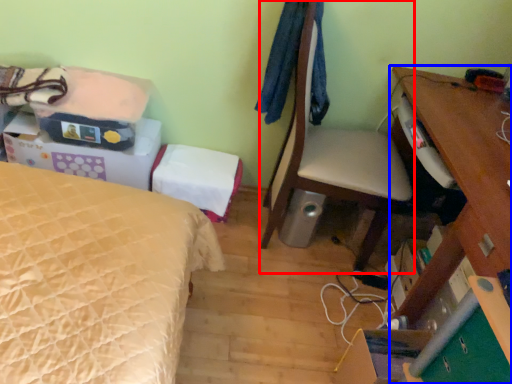
Question: Which of the following is the closest to the observer, chair (highlighted by a red box) or desk (highlighted by a blue box)?

Choices:
 (A) chair
 (B) desk

Answer: (B)